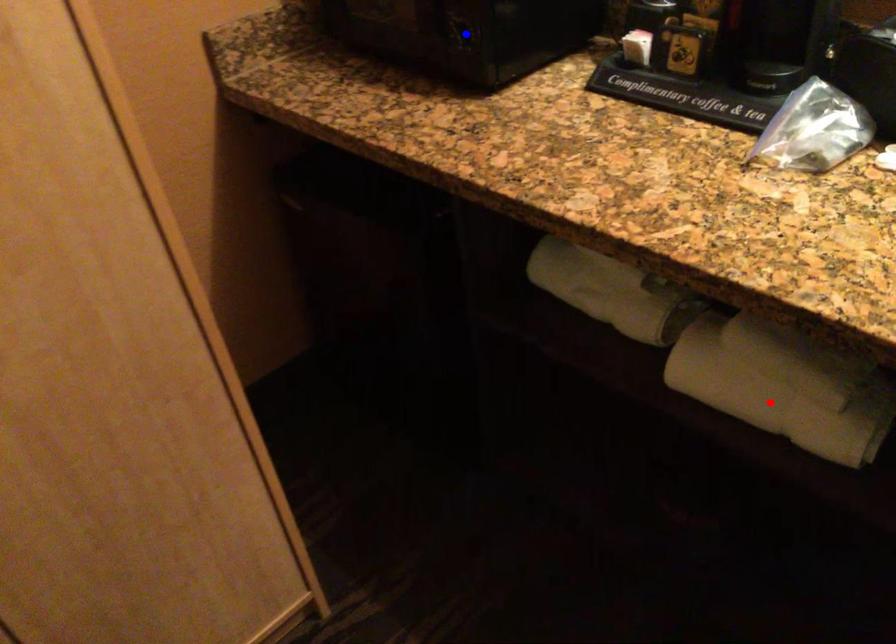
Question: Two points are marked on the image. Which point is closer to the camera?

Choices:
 (A) Blue point is closer.
 (B) Red point is closer.

Answer: (B)